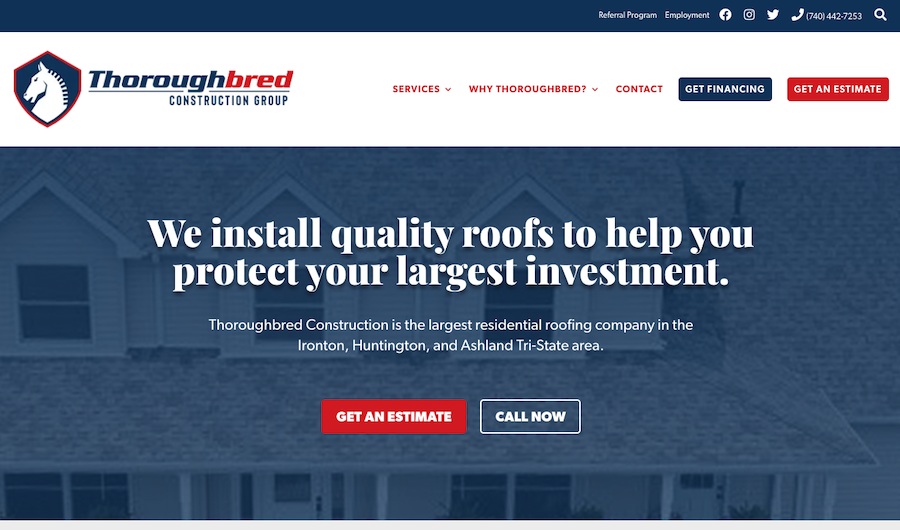
Locate an element on the screen. This screenshot has width=900, height=530. three windows on second floor is located at coordinates (69, 307), (306, 315), (536, 311).